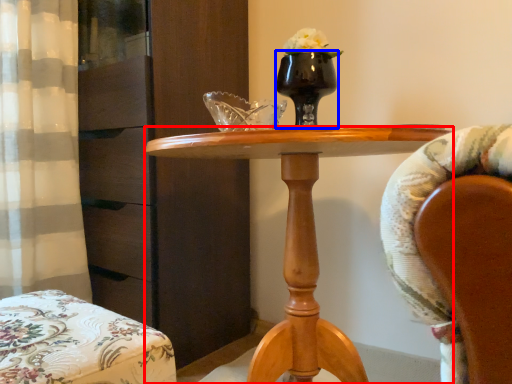
Question: Among these objects, which one is farthest to the camera, desk (highlighted by a red box) or vase (highlighted by a blue box)?

Choices:
 (A) desk
 (B) vase

Answer: (B)